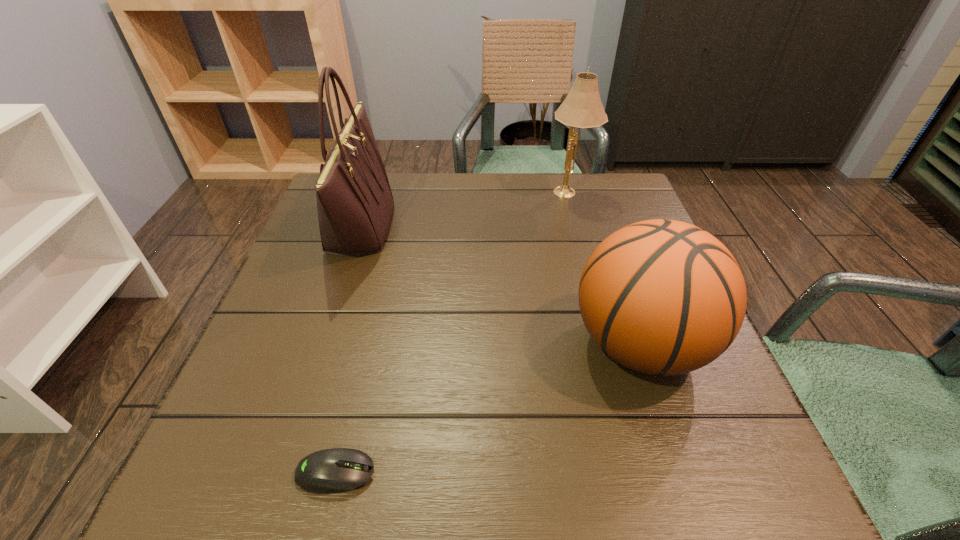
Where is `handbag that is positioned at the far edge`? Image resolution: width=960 pixels, height=540 pixels. handbag that is positioned at the far edge is located at coordinates (355, 204).

Identify the location of lampshade positioned at the far edge. (582, 108).

You are a GUI agent. You are given a task and a screenshot of the screen. Output one action in this format:
    pyautogui.click(x=<x>, y=<y>)
    Task: Click on the object that is at the near edge
    The height and width of the screenshot is (540, 960).
    Given the screenshot: What is the action you would take?
    pyautogui.click(x=336, y=470)

The width and height of the screenshot is (960, 540). In order to click on handbag present at the left edge in this screenshot , I will do `click(355, 204)`.

Locate an element on the screen. computer mouse present at the left edge is located at coordinates [x=336, y=470].

Find the location of a particular element. lampshade that is positioned at the right edge is located at coordinates (582, 108).

The height and width of the screenshot is (540, 960). In order to click on basketball located at the right edge in this screenshot , I will do `click(664, 297)`.

Where is `object that is at the far left corner`? The image size is (960, 540). object that is at the far left corner is located at coordinates (355, 204).

The height and width of the screenshot is (540, 960). What are the coordinates of `object located at the near left corner` in the screenshot? It's located at pos(336,470).

You are a GUI agent. You are given a task and a screenshot of the screen. Output one action in this format:
    pyautogui.click(x=<x>, y=<y>)
    Task: Click on the object that is at the far right corner
    The image size is (960, 540).
    Given the screenshot: What is the action you would take?
    click(582, 108)